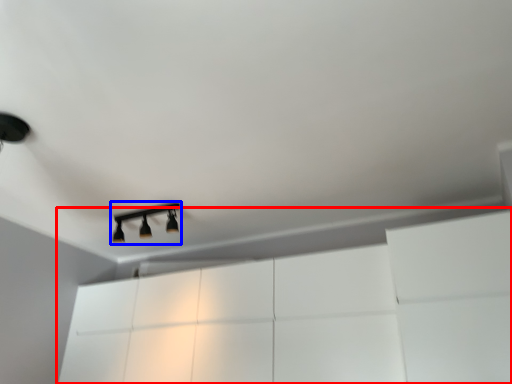
Question: Which of the following is the closest to the observer, dresser (highlighted by a red box) or lamp (highlighted by a blue box)?

Choices:
 (A) dresser
 (B) lamp

Answer: (A)